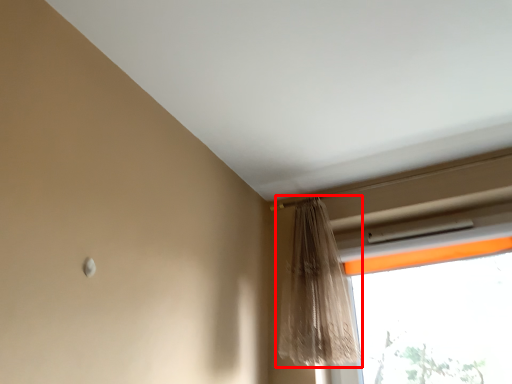
Question: Observing the image, what is the correct spatial positioning of curtain (annotated by the red box) in reference to window?

Choices:
 (A) left
 (B) right

Answer: (A)